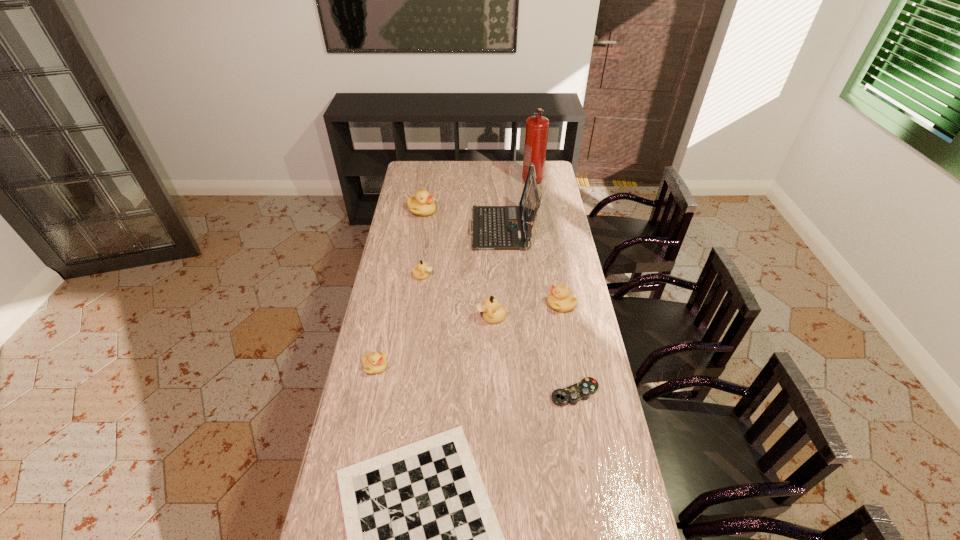
At what (x,y) coordinates should I click in order to perform the action: click on fire extinguisher located in the right edge section of the desktop. Please return your answer as a coordinate pair (x, y). Image resolution: width=960 pixels, height=540 pixels. Looking at the image, I should click on (536, 134).

Identify the location of laptop computer present at the right edge. The height and width of the screenshot is (540, 960). (494, 227).

This screenshot has height=540, width=960. I want to click on duckling present at the right edge, so click(x=560, y=299).

At what (x,y) coordinates should I click in order to perform the action: click on control situated at the right edge. Please return your answer as a coordinate pair (x, y). Image resolution: width=960 pixels, height=540 pixels. Looking at the image, I should click on (572, 394).

Locate an element on the screen. The height and width of the screenshot is (540, 960). object located at the far right corner is located at coordinates (536, 134).

What are the coordinates of `free space at the left edge of the desktop` in the screenshot? It's located at (399, 289).

Where is `free spot at the right edge of the desktop`? free spot at the right edge of the desktop is located at coordinates (551, 189).

This screenshot has width=960, height=540. Identify the location of free space at the far left corner of the desktop. (419, 173).

The width and height of the screenshot is (960, 540). I want to click on blank region between the eighth tallest object and the smallest yellow duckling, so click(475, 380).

Where is `vacant area that lies between the second nearest object and the second farthest yellow duckling`? vacant area that lies between the second nearest object and the second farthest yellow duckling is located at coordinates (568, 349).